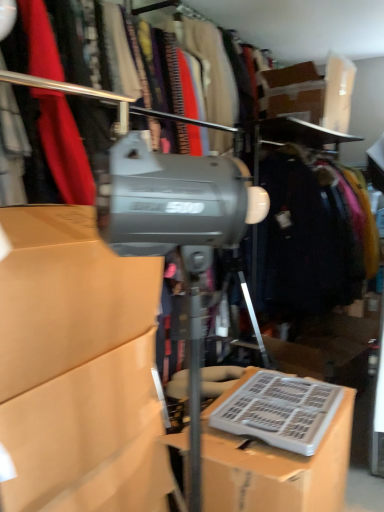
Locate an element on the screen. Image resolution: width=384 pixels, height=512 pixels. matte cardboard box at center, which is the second box from right to left is located at coordinates (78, 368).

Measure the distance between point [337,173] and camera.

Point [337,173] and camera are 8.78 feet apart from each other.

Describe the element at coordinates (280, 411) in the screenshot. I see `white plastic keyboard at lower right` at that location.

The image size is (384, 512). In order to click on matte cardboard box at center, which is counted as the first box, starting from the left in this screenshot , I will do `click(78, 368)`.

Measure the distance from dark blue fabric coat at right to cardboard box at center, which appears as the first box when viewed from the right.

3.69 feet.

Is cardboard box at center, which appears as the first box when viewed from the right, a part of dark blue fabric coat at right?

That's incorrect, cardboard box at center, which appears as the first box when viewed from the right, is not inside dark blue fabric coat at right.

From a real-world perspective, which object rests below the other?

From a 3D spatial view, cardboard box at center, which is the second box from left to right, is below.

From the image's perspective, is dark blue fabric coat at right on cardboard box at center, which appears as the first box when viewed from the right?

Indeed, from the image's perspective, dark blue fabric coat at right is shown above cardboard box at center, which appears as the first box when viewed from the right.

Based on the photo, from the image's perspective, is matte cardboard box at center, which is counted as the first box, starting from the left, above or below cardboard box at center, which is the second box from left to right?

From the image's perspective, matte cardboard box at center, which is counted as the first box, starting from the left, appears above cardboard box at center, which is the second box from left to right.

Consider the image. Between matte cardboard box at center, which is the second box from right to left, and cardboard box at center, which is the second box from left to right, which one has larger size?

cardboard box at center, which is the second box from left to right.

Can we say matte cardboard box at center, which is counted as the first box, starting from the left, lies outside cardboard box at center, which appears as the first box when viewed from the right?

Indeed, matte cardboard box at center, which is counted as the first box, starting from the left, is completely outside cardboard box at center, which appears as the first box when viewed from the right.

Could you tell me if matte gray tripod at center is turned towards dark blue fabric coat at right?

No.

Based on the photo, does matte gray tripod at center have a lesser width compared to dark blue fabric coat at right?

Indeed, matte gray tripod at center has a lesser width compared to dark blue fabric coat at right.

Is matte gray tripod at center next to dark blue fabric coat at right and touching it?

No, matte gray tripod at center is not touching dark blue fabric coat at right.

Is matte gray tripod at center taller or shorter than dark blue fabric coat at right?

In the image, matte gray tripod at center appears to be shorter than dark blue fabric coat at right.

Is point (224, 396) closer or farther from the camera than point (294, 402)?

Clearly, point (224, 396) is more distant from the camera than point (294, 402).

From a real-world perspective, which object rests below the other?

cardboard box at center, which is the second box from left to right, is physically lower.

What's the angular difference between cardboard box at center, which is the second box from left to right, and white plastic keyboard at lower right's facing directions?

0.000997 degrees.

Does cardboard box at center, which appears as the first box when viewed from the right, touch white plastic keyboard at lower right?

Yes, cardboard box at center, which appears as the first box when viewed from the right, and white plastic keyboard at lower right clearly make contact.

Consider the image. Is dark blue fabric coat at right looking in the opposite direction of matte gray tripod at center?

dark blue fabric coat at right does not have its back to matte gray tripod at center.

From the image's perspective, between dark blue fabric coat at right and matte gray tripod at center, who is located below?

matte gray tripod at center, from the image's perspective.

Considering the relative sizes of dark blue fabric coat at right and matte gray tripod at center in the image provided, is dark blue fabric coat at right taller than matte gray tripod at center?

Yes, dark blue fabric coat at right is taller than matte gray tripod at center.

From a real-world perspective, does dark blue fabric coat at right stand above matte gray tripod at center?

No.

The height and width of the screenshot is (512, 384). Find the location of `wide located below the dark blue fabric coat at right (from the image's perspective)`. wide located below the dark blue fabric coat at right (from the image's perspective) is located at coordinates (280, 411).

Who is smaller, dark blue fabric coat at right or white plastic keyboard at lower right?

With smaller size is white plastic keyboard at lower right.

Considering the relative positions of dark blue fabric coat at right and white plastic keyboard at lower right in the image provided, is dark blue fabric coat at right to the right of white plastic keyboard at lower right from the viewer's perspective?

Yes, dark blue fabric coat at right is to the right of white plastic keyboard at lower right.

From a real-world perspective, relative to dark blue fabric coat at right, is matte cardboard box at center, which is counted as the first box, starting from the left, vertically above or below?

In terms of real-world spatial position, matte cardboard box at center, which is counted as the first box, starting from the left, is below dark blue fabric coat at right.

Which point is more distant from viewer, (160, 282) or (337, 270)?

The point (337, 270) is behind.

Is matte cardboard box at center, which is the second box from right to left, next to dark blue fabric coat at right?

No, matte cardboard box at center, which is the second box from right to left, is not next to dark blue fabric coat at right.

From the image's perspective, which one is positioned lower, matte cardboard box at center, which is the second box from right to left, or dark blue fabric coat at right?

matte cardboard box at center, which is the second box from right to left.

The image size is (384, 512). Find the location of `clothing positioned vertically above the cardboard box at center, which is the second box from left to right (from a real-world perspective)`. clothing positioned vertically above the cardboard box at center, which is the second box from left to right (from a real-world perspective) is located at coordinates pyautogui.click(x=309, y=236).

In order to click on box to the right of matte cardboard box at center, which is counted as the first box, starting from the left in this screenshot , I will do `click(274, 466)`.

When comparing their distances from dark blue fabric coat at right, does white plastic keyboard at lower right or cardboard box at center, which is the second box from left to right, seem closer?

Based on the image, white plastic keyboard at lower right appears to be nearer to dark blue fabric coat at right.

Estimate the real-world distances between objects in this image. Which object is closer to cardboard box at center, which appears as the first box when viewed from the right, matte cardboard box at center, which is counted as the first box, starting from the left, or white plastic keyboard at lower right?

Based on the image, white plastic keyboard at lower right appears to be nearer to cardboard box at center, which appears as the first box when viewed from the right.

Based on the photo, estimate the real-world distances between objects in this image. Which object is closer to white plastic keyboard at lower right, cardboard box at center, which is the second box from left to right, or matte cardboard box at center, which is counted as the first box, starting from the left?

cardboard box at center, which is the second box from left to right, lies closer to white plastic keyboard at lower right than the other object.

Estimate the real-world distances between objects in this image. Which object is further from white plastic keyboard at lower right, matte cardboard box at center, which is counted as the first box, starting from the left, or dark blue fabric coat at right?

Based on the image, dark blue fabric coat at right appears to be further to white plastic keyboard at lower right.

From the image, which object appears to be nearer to cardboard box at center, which appears as the first box when viewed from the right, dark blue fabric coat at right or matte gray tripod at center?

The object closer to cardboard box at center, which appears as the first box when viewed from the right, is dark blue fabric coat at right.

Estimate the real-world distances between objects in this image. Which object is further from dark blue fabric coat at right, cardboard box at center, which is the second box from left to right, or white plastic keyboard at lower right?

cardboard box at center, which is the second box from left to right, is further to dark blue fabric coat at right.

Considering their positions, is white plastic keyboard at lower right positioned further to dark blue fabric coat at right than matte cardboard box at center, which is the second box from right to left?

Based on the image, matte cardboard box at center, which is the second box from right to left, appears to be further to dark blue fabric coat at right.

From the image, which object appears to be farther from cardboard box at center, which appears as the first box when viewed from the right, white plastic keyboard at lower right or matte cardboard box at center, which is counted as the first box, starting from the left?

The object further to cardboard box at center, which appears as the first box when viewed from the right, is matte cardboard box at center, which is counted as the first box, starting from the left.

The width and height of the screenshot is (384, 512). What are the coordinates of `wide between matte gray tripod at center and dark blue fabric coat at right in the front-back direction` in the screenshot? It's located at (280, 411).

This screenshot has width=384, height=512. Find the location of `box located between matte cardboard box at center, which is the second box from right to left, and white plastic keyboard at lower right in the left-right direction`. box located between matte cardboard box at center, which is the second box from right to left, and white plastic keyboard at lower right in the left-right direction is located at coordinates (274, 466).

Image resolution: width=384 pixels, height=512 pixels. What are the coordinates of `box positioned between matte cardboard box at center, which is counted as the first box, starting from the left, and dark blue fabric coat at right from near to far` in the screenshot? It's located at (274, 466).

Where is `wide between cardboard box at center, which is the second box from left to right, and dark blue fabric coat at right, along the z-axis`? This screenshot has height=512, width=384. wide between cardboard box at center, which is the second box from left to right, and dark blue fabric coat at right, along the z-axis is located at coordinates (280, 411).